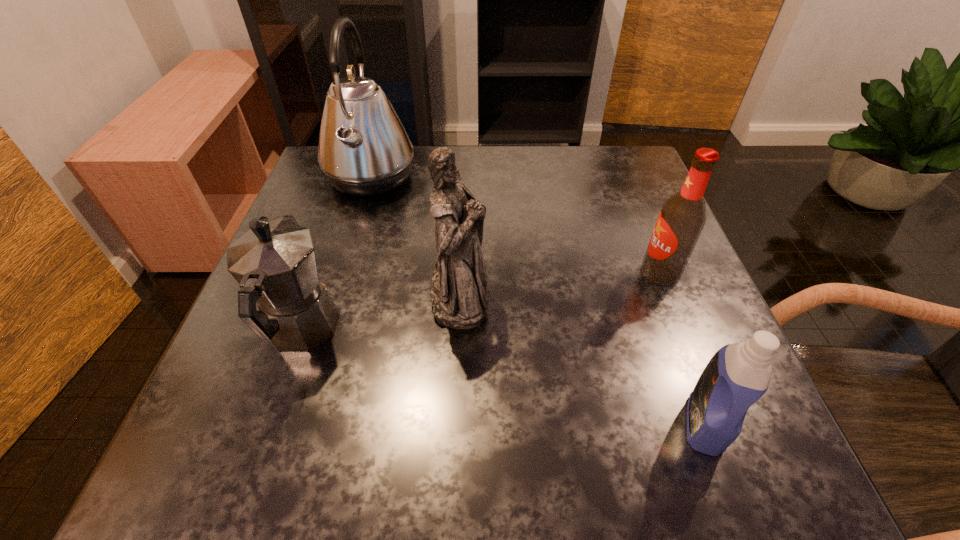
Locate an element on the screen. The image size is (960, 540). vacant area situated 0.250m on the pouring side of the coffeepot is located at coordinates (346, 205).

Where is `vacant space located 0.050m on the pouring side of the coffeepot`? The width and height of the screenshot is (960, 540). vacant space located 0.050m on the pouring side of the coffeepot is located at coordinates (324, 268).

The width and height of the screenshot is (960, 540). I want to click on vacant region located 0.320m on the back of the nearest object, so click(639, 249).

The width and height of the screenshot is (960, 540). I want to click on object that is at the far edge, so click(x=364, y=150).

At what (x,y) coordinates should I click in order to perform the action: click on object that is at the near edge. Please return your answer as a coordinate pair (x, y). This screenshot has height=540, width=960. Looking at the image, I should click on (738, 374).

Identify the location of kettle at the left edge. (364, 150).

You are a GUI agent. You are given a task and a screenshot of the screen. Output one action in this format:
    pyautogui.click(x=<x>, y=<y>)
    Task: Click on the coffeepot situated at the left edge
    This screenshot has width=960, height=540.
    Given the screenshot: What is the action you would take?
    pyautogui.click(x=274, y=262)

The image size is (960, 540). I want to click on beer bottle that is at the right edge, so click(x=682, y=217).

Image resolution: width=960 pixels, height=540 pixels. Find the location of `detergent that is at the right edge`. detergent that is at the right edge is located at coordinates (738, 374).

Locate an element on the screen. The image size is (960, 540). object that is at the far left corner is located at coordinates (364, 150).